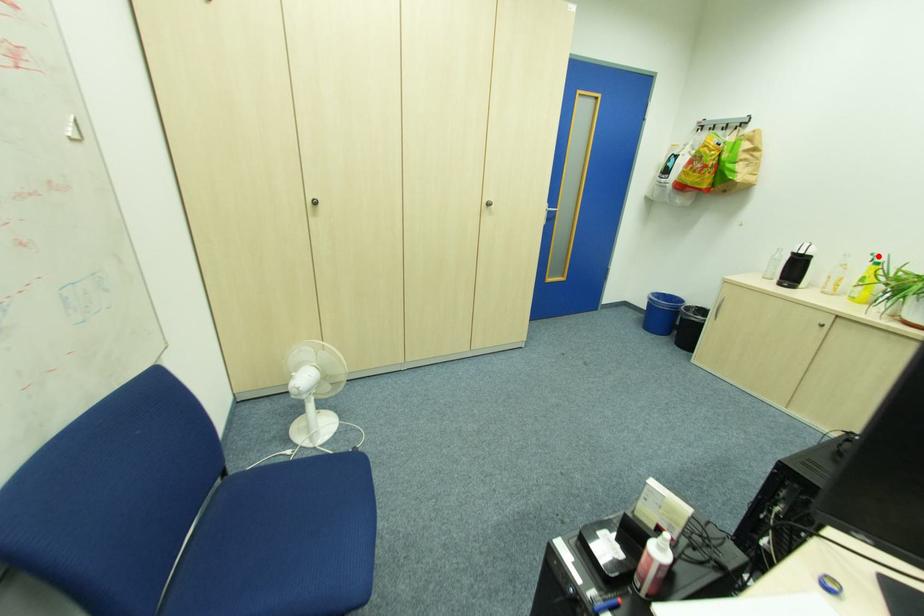
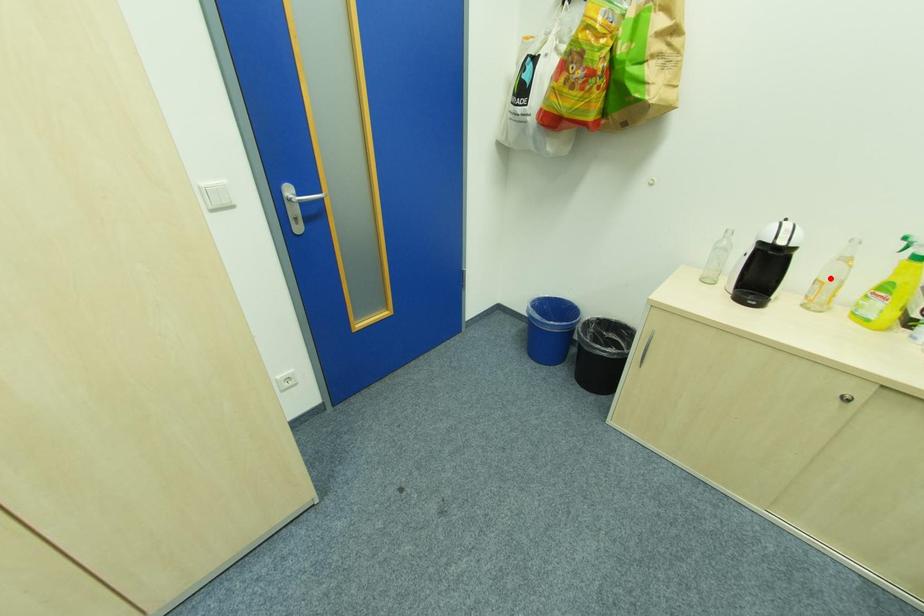
I am providing you with two images of the same scene from different viewpoints. A red point is marked on the first image and another point is marked on the second image. Do the highlighted points in image1 and image2 indicate the same real-world spot?

No